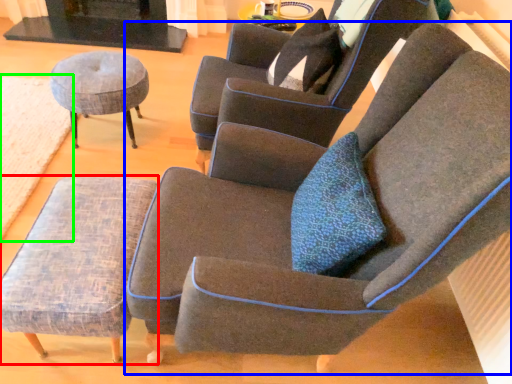
Question: Which object is positioned closest to stool (highlighted by a red box)? Select from chair (highlighted by a blue box) and mat (highlighted by a green box).

Choices:
 (A) chair
 (B) mat

Answer: (A)